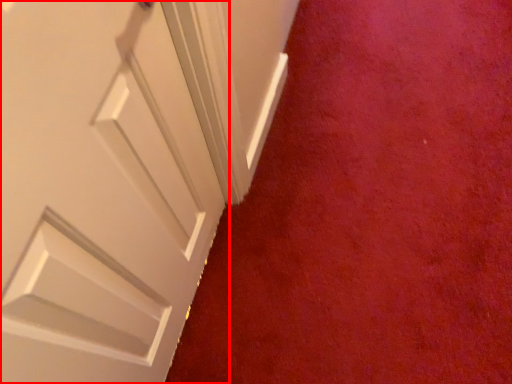
Question: From the image's perspective, where is door (annotated by the red box) located relative to plain?

Choices:
 (A) above
 (B) below

Answer: (B)